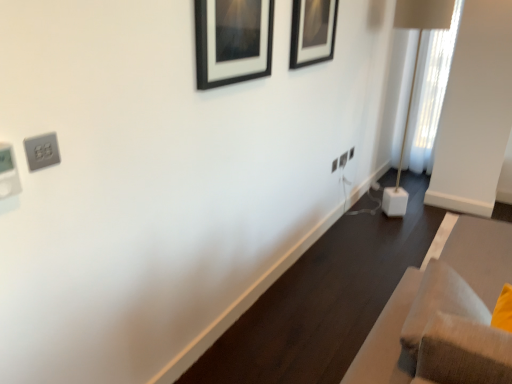
Question: Can you confirm if white sheer curtain at right is wider than white cube base at right?

Choices:
 (A) yes
 (B) no

Answer: (B)

Question: Is white sheer curtain at right facing towards white cube base at right?

Choices:
 (A) no
 (B) yes

Answer: (B)

Question: Is white sheer curtain at right thinner than white cube base at right?

Choices:
 (A) yes
 (B) no

Answer: (A)

Question: Is white sheer curtain at right behind white cube base at right?

Choices:
 (A) yes
 (B) no

Answer: (A)

Question: Is white sheer curtain at right bigger than white cube base at right?

Choices:
 (A) yes
 (B) no

Answer: (B)

Question: Is white sheer curtain at right next to white cube base at right?

Choices:
 (A) no
 (B) yes

Answer: (A)

Question: From a real-world perspective, is white plastic electric outlet at center-right, marked as the second electric outlet in a right-to-left arrangement, located beneath black matte picture frame at upper center, placed as the first picture frame when sorted from right to left?

Choices:
 (A) yes
 (B) no

Answer: (A)

Question: Can you confirm if white plastic electric outlet at center-right, placed as the second electric outlet when sorted from left to right, is wider than black matte picture frame at upper center, acting as the second picture frame starting from the front?

Choices:
 (A) no
 (B) yes

Answer: (A)

Question: Would you say white plastic electric outlet at center-right, which is the second electric outlet from bottom to top, is a long distance from black matte picture frame at upper center, the second picture frame in the left-to-right sequence?

Choices:
 (A) no
 (B) yes

Answer: (B)

Question: Is white plastic electric outlet at center-right, which is the second electric outlet from back to front, to the left of black matte picture frame at upper center, acting as the second picture frame starting from the front, from the viewer's perspective?

Choices:
 (A) yes
 (B) no

Answer: (B)

Question: Considering the relative sizes of white plastic electric outlet at center-right, marked as the second electric outlet in a right-to-left arrangement, and black matte picture frame at upper center, placed as the first picture frame when sorted from right to left, in the image provided, is white plastic electric outlet at center-right, marked as the second electric outlet in a right-to-left arrangement, thinner than black matte picture frame at upper center, placed as the first picture frame when sorted from right to left,?

Choices:
 (A) no
 (B) yes

Answer: (B)

Question: Is the depth of white plastic electric outlet at center-right, marked as the second electric outlet in a right-to-left arrangement, less than that of black matte picture frame at upper center, acting as the second picture frame starting from the front?

Choices:
 (A) yes
 (B) no

Answer: (B)

Question: Can you confirm if satin silver outlet at upper left, the 3th electric outlet when ordered from top to bottom, is shorter than black matte picture frame at upper center, which is the first picture frame in back-to-front order?

Choices:
 (A) no
 (B) yes

Answer: (B)